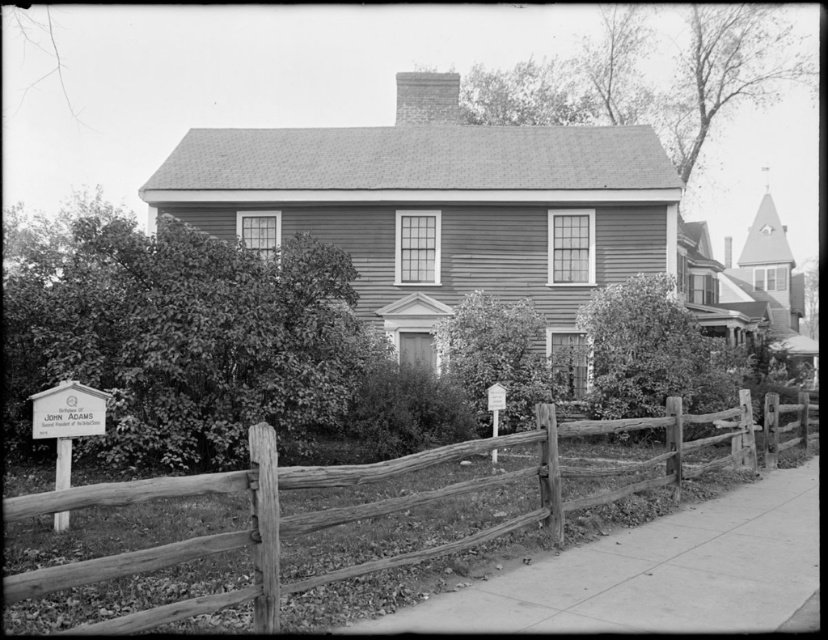
Question: Which object appears farthest from the camera in this image?

Choices:
 (A) white wood sign at lower left
 (B) wooden at lower left

Answer: (A)

Question: Is wooden at lower left positioned in front of white wood sign at lower left?

Choices:
 (A) yes
 (B) no

Answer: (A)

Question: In this image, where is wooden at lower left located relative to white wood sign at lower left?

Choices:
 (A) right
 (B) left

Answer: (A)

Question: Does wooden at lower left have a lesser width compared to white wood sign at lower left?

Choices:
 (A) yes
 (B) no

Answer: (B)

Question: Among these objects, which one is nearest to the camera?

Choices:
 (A) white wood sign at lower left
 (B) wooden at lower left

Answer: (B)